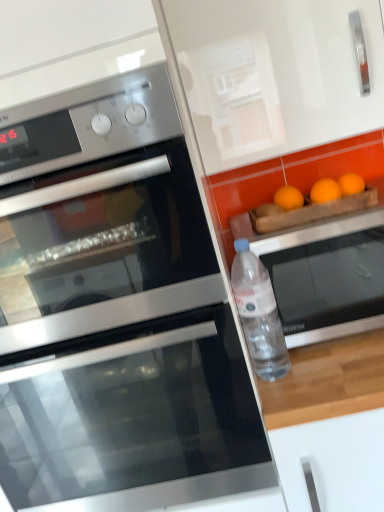
Question: From the image's perspective, is stainless steel oven at left, which ranks as the 1th oven in left-to-right order, above or below stainless steel oven at right, the 3th oven positioned from the left?

Choices:
 (A) below
 (B) above

Answer: (B)

Question: Is stainless steel oven at left, which ranks as the 1th oven in left-to-right order, inside or outside of stainless steel oven at right, the 3th oven positioned from the left?

Choices:
 (A) inside
 (B) outside

Answer: (B)

Question: Which is nearer to the transparent plastic bottle at right?

Choices:
 (A) stainless steel oven at lower left, which ranks as the second oven in left-to-right order
 (B) stainless steel oven at left, which appears as the 3th oven when viewed from the right
 (C) stainless steel oven at right, which is the first oven in right-to-left order

Answer: (C)

Question: Which of these objects is positioned closest to the transparent plastic bottle at right?

Choices:
 (A) stainless steel oven at lower left, which is counted as the second oven, starting from the right
 (B) stainless steel oven at left, which appears as the 3th oven when viewed from the right
 (C) stainless steel oven at right, the 3th oven positioned from the left

Answer: (C)